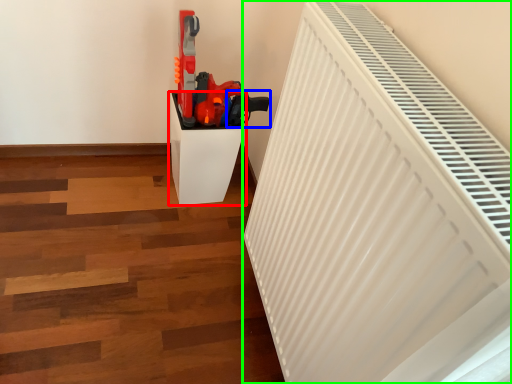
Question: Which is nearer to the furniture (highlighted by a red box)? weapon (highlighted by a blue box) or radiator (highlighted by a green box).

Choices:
 (A) weapon
 (B) radiator

Answer: (A)